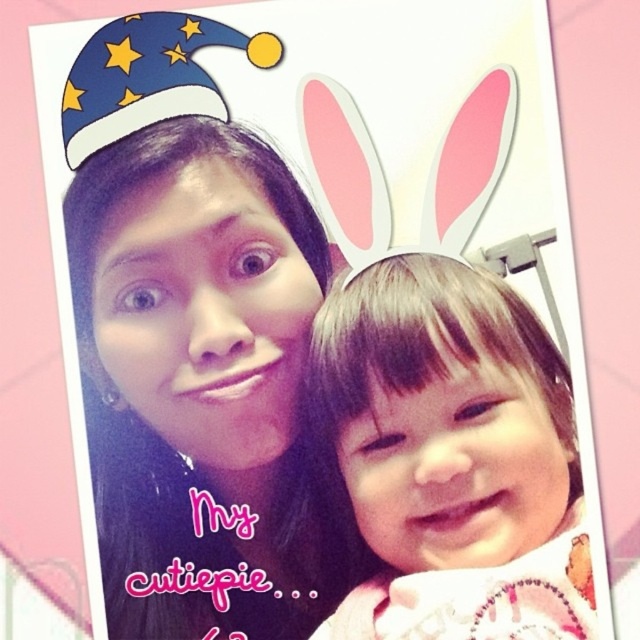
Is matte black hair at center taller than smooth skin baby at center?

Yes, matte black hair at center is taller than smooth skin baby at center.

Find the location of a particular element. matte black hair at center is located at coordinates (200, 372).

Where is `matte black hair at center`? The image size is (640, 640). matte black hair at center is located at coordinates point(200,372).